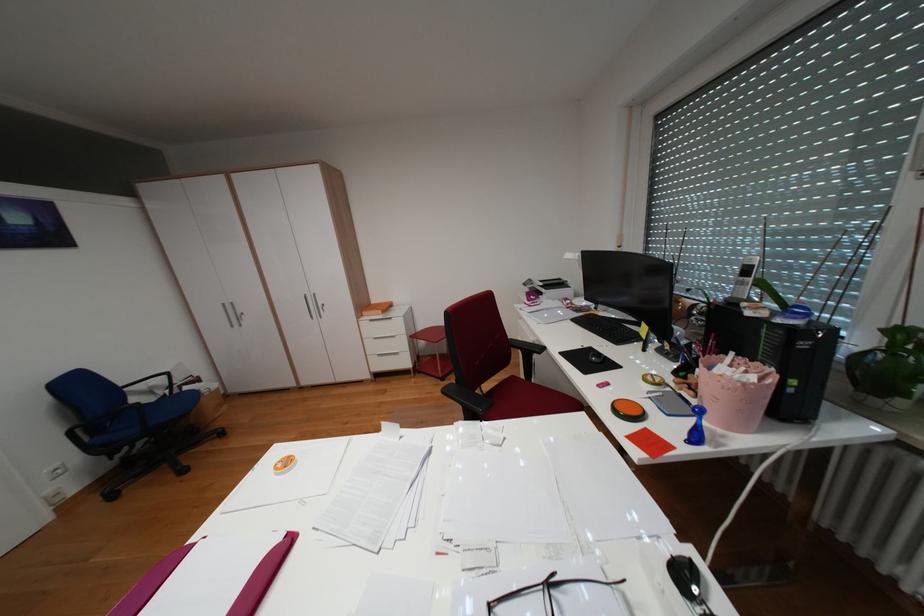
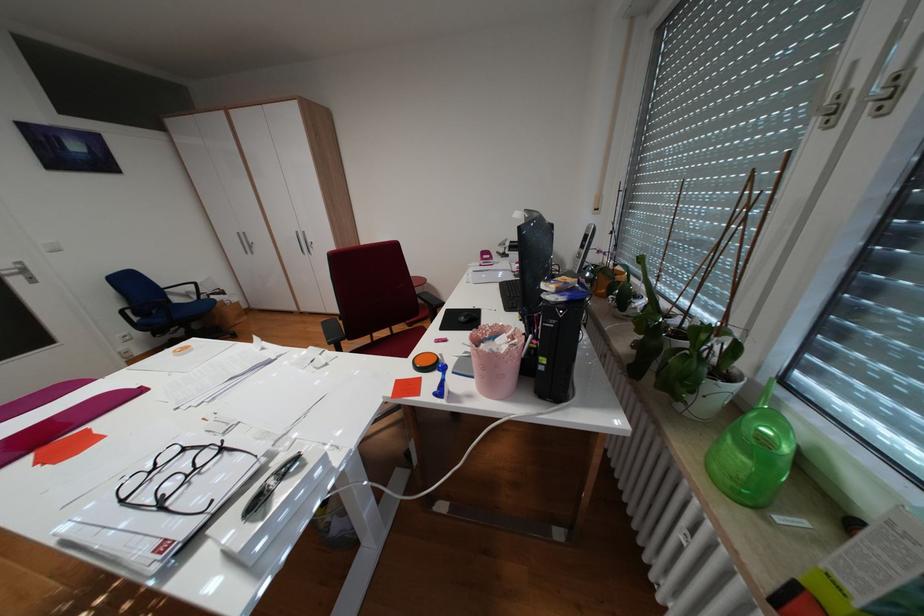
In the second image, find the point that corresponds to point (889, 400) in the first image.

(691, 405)